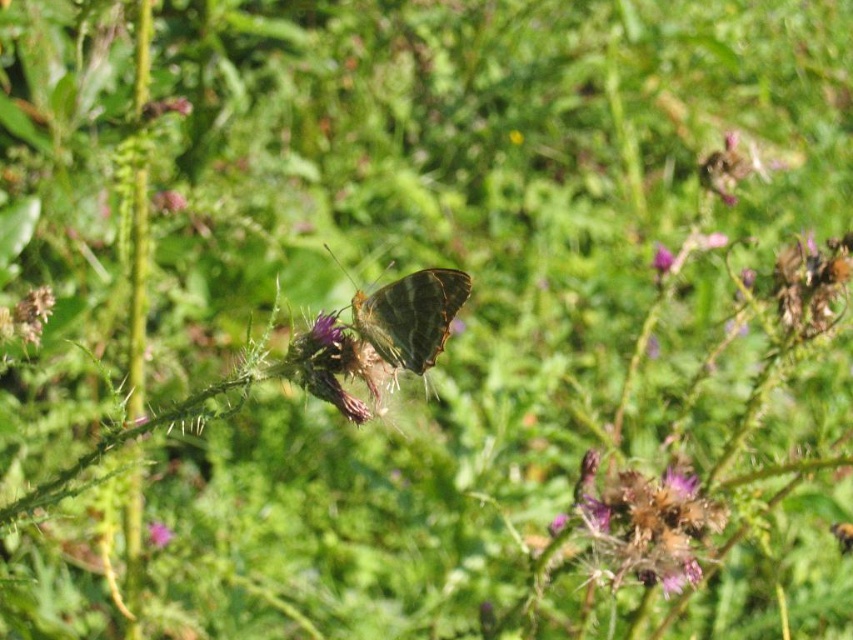
From the picture: Which is more to the right, purple fuzzy thistle at center or purple fuzzy flower at center?

From the viewer's perspective, purple fuzzy thistle at center appears more on the right side.

Is point (614, 506) less distant than point (154, 536)?

Yes, it is in front of point (154, 536).

Does point (671, 538) come closer to viewer compared to point (149, 529)?

Yes, point (671, 538) is closer to viewer.

Where is `purple fuzzy thistle at center`? This screenshot has height=640, width=853. purple fuzzy thistle at center is located at coordinates (643, 524).

Can you confirm if purple fuzzy flower at center is thinner than purple matte flower at center?

Incorrect, purple fuzzy flower at center's width is not less than purple matte flower at center's.

In the scene shown: Does purple fuzzy flower at center have a larger size compared to purple matte flower at center?

No, purple fuzzy flower at center is not bigger than purple matte flower at center.

Between point (158, 529) and point (654, 266), which one is positioned in front?

Point (654, 266) is in front.

The width and height of the screenshot is (853, 640). Identify the location of purple fuzzy flower at center. (158, 532).

Can you confirm if shiny brown butterfly at center is taller than purple matte flower at center?

Correct, shiny brown butterfly at center is much taller as purple matte flower at center.

Who is more forward, (463, 289) or (662, 268)?

Point (463, 289)

Where is `shiny brown butterfly at center`? The image size is (853, 640). shiny brown butterfly at center is located at coordinates (410, 316).